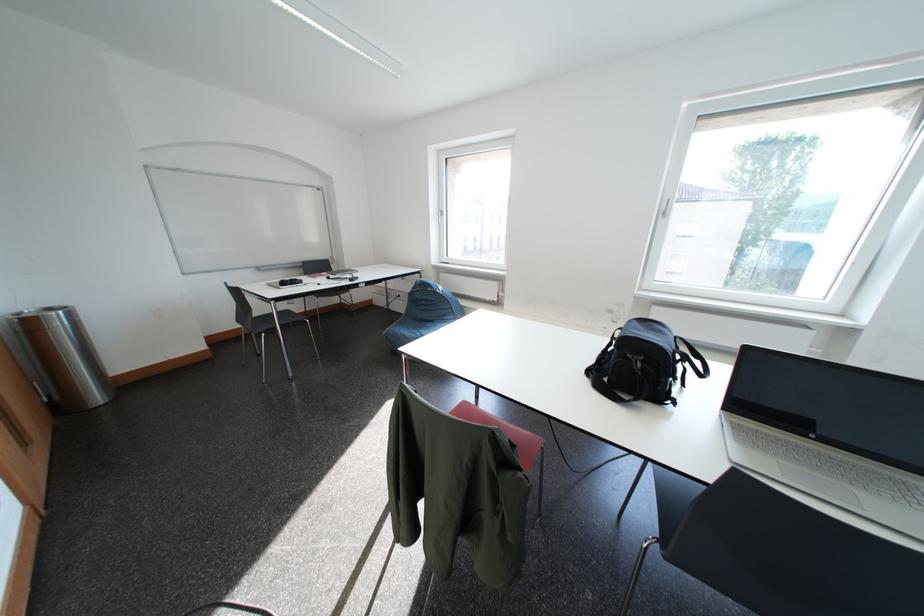
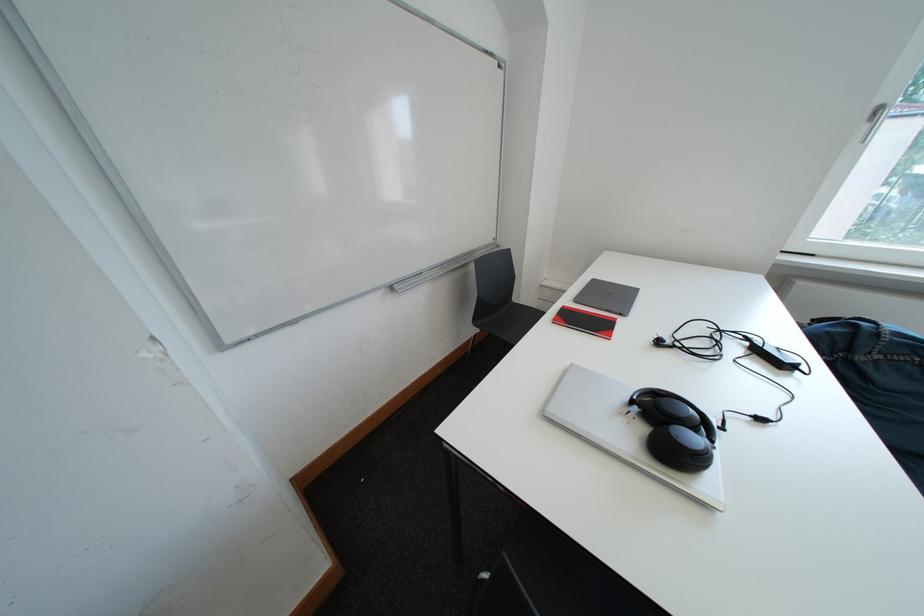
The images are taken continuously from a first-person perspective. In which direction are you moving?

The cameraman walked toward left, forward.